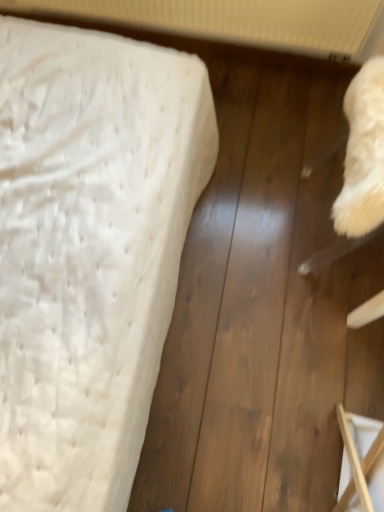
Image resolution: width=384 pixels, height=512 pixels. Describe the element at coordinates (360, 463) in the screenshot. I see `wooden frame at lower right` at that location.

Where is `white textured mattress at left`? white textured mattress at left is located at coordinates 89,251.

Is white textured radiator at upper center wider or thinner than wooden frame at lower right?

In the image, white textured radiator at upper center appears to be more narrow than wooden frame at lower right.

From a real-world perspective, is white textured radiator at upper center beneath wooden frame at lower right?

No, from a real-world perspective, white textured radiator at upper center is not below wooden frame at lower right.

Can you confirm if white textured radiator at upper center is positioned to the left of wooden frame at lower right?

Yes.

From the picture: How many degrees apart are the facing directions of white textured radiator at upper center and wooden frame at lower right?

There is a 87.6-degree angle between the facing directions of white textured radiator at upper center and wooden frame at lower right.

Is white textured mattress at left to the left of white textured radiator at upper center from the viewer's perspective?

Indeed, white textured mattress at left is positioned on the left side of white textured radiator at upper center.

From a real-world perspective, which is physically above, white textured mattress at left or white textured radiator at upper center?

white textured radiator at upper center is physically above.

Image resolution: width=384 pixels, height=512 pixels. I want to click on bed lying on the left of white textured radiator at upper center, so click(x=89, y=251).

Is white textured mattress at left facing away from white textured radiator at upper center?

No, white textured mattress at left is not facing the opposite direction of white textured radiator at upper center.

From the picture: Can you confirm if wooden frame at lower right is positioned to the right of white textured mattress at left?

Indeed, wooden frame at lower right is positioned on the right side of white textured mattress at left.

Considering the relative sizes of wooden frame at lower right and white textured mattress at left in the image provided, is wooden frame at lower right shorter than white textured mattress at left?

No, wooden frame at lower right is not shorter than white textured mattress at left.

What's the angular difference between wooden frame at lower right and white textured mattress at left's facing directions?

The facing directions of wooden frame at lower right and white textured mattress at left are 87.6 degrees apart.

Is wooden frame at lower right a part of white textured mattress at left?

No.

Measure the distance between white textured mattress at left and wooden frame at lower right.

white textured mattress at left is 72.72 centimeters away from wooden frame at lower right.

From a real-world perspective, which object stands above the other?

In real-world perspective, wooden frame at lower right is above.

Is white textured mattress at left far away from wooden frame at lower right?

That's not correct — white textured mattress at left is a little close to wooden frame at lower right.

Consider the image. In the image, is white textured radiator at upper center positioned in front of or behind white textured mattress at left?

white textured radiator at upper center is behind white textured mattress at left.

Does white textured radiator at upper center appear on the right side of white textured mattress at left?

Yes.

From the image's perspective, is white textured radiator at upper center below white textured mattress at left?

Incorrect, from the image's perspective, white textured radiator at upper center is higher than white textured mattress at left.

Based on the photo, is white textured radiator at upper center wider than white textured mattress at left?

No.

Is wooden frame at lower right oriented away from white textured radiator at upper center?

wooden frame at lower right does not have its back to white textured radiator at upper center.

Does wooden frame at lower right have a lesser width compared to white textured radiator at upper center?

No.

From a real-world perspective, which object stands above the other?

white textured radiator at upper center.

You are a GUI agent. You are given a task and a screenshot of the screen. Output one action in this format:
    pyautogui.click(x=<x>, y=<y>)
    Task: Click on the radiator above the wooden frame at lower right (from a real-world perspective)
    The height and width of the screenshot is (512, 384).
    Given the screenshot: What is the action you would take?
    pyautogui.click(x=241, y=20)

Image resolution: width=384 pixels, height=512 pixels. Identify the location of bed that is below the white textured radiator at upper center (from the image's perspective). pos(89,251).

From the image, which object appears to be nearer to wooden frame at lower right, white textured mattress at left or white textured radiator at upper center?

Based on the image, white textured mattress at left appears to be nearer to wooden frame at lower right.

Which object lies nearer to the anchor point white textured mattress at left, white textured radiator at upper center or wooden frame at lower right?

wooden frame at lower right lies closer to white textured mattress at left than the other object.

When comparing their distances from wooden frame at lower right, does white textured radiator at upper center or white textured mattress at left seem closer?

The object closer to wooden frame at lower right is white textured mattress at left.

From the image, which object appears to be farther from white textured mattress at left, wooden frame at lower right or white textured radiator at upper center?

white textured radiator at upper center is further to white textured mattress at left.

Considering their positions, is wooden frame at lower right positioned further to white textured radiator at upper center than white textured mattress at left?

wooden frame at lower right.

Looking at the image, which one is located closer to white textured radiator at upper center, white textured mattress at left or wooden frame at lower right?

Based on the image, white textured mattress at left appears to be nearer to white textured radiator at upper center.

The height and width of the screenshot is (512, 384). In order to click on bed between white textured radiator at upper center and wooden frame at lower right from top to bottom in this screenshot , I will do `click(89, 251)`.